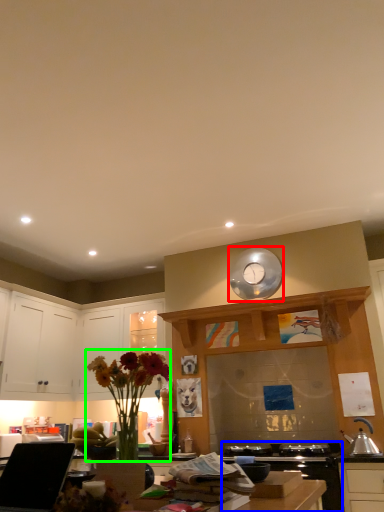
Question: Considering the real-world distances, which object is farthest from clock (highlighted by a red box)? appliance (highlighted by a blue box) or floral arrangement (highlighted by a green box)?

Choices:
 (A) appliance
 (B) floral arrangement

Answer: (B)